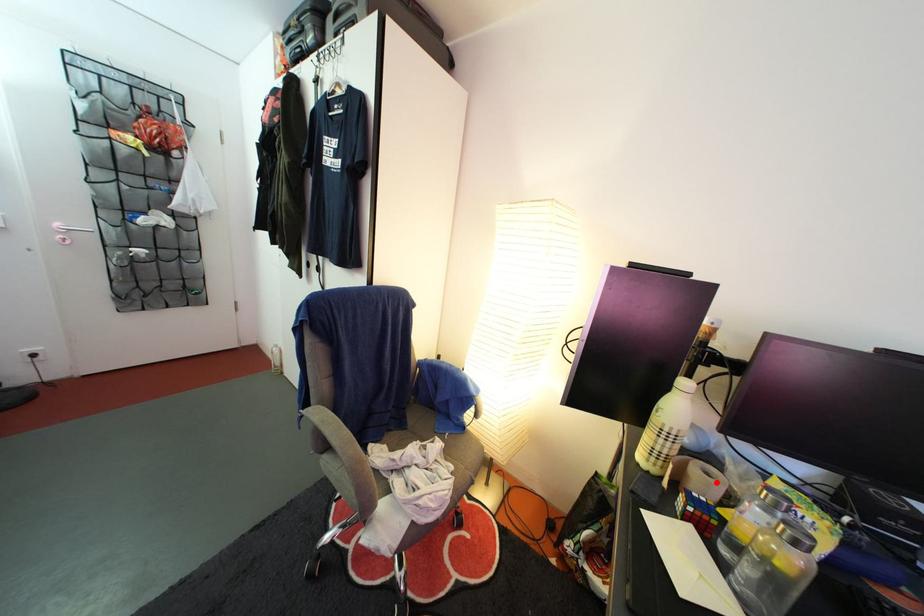
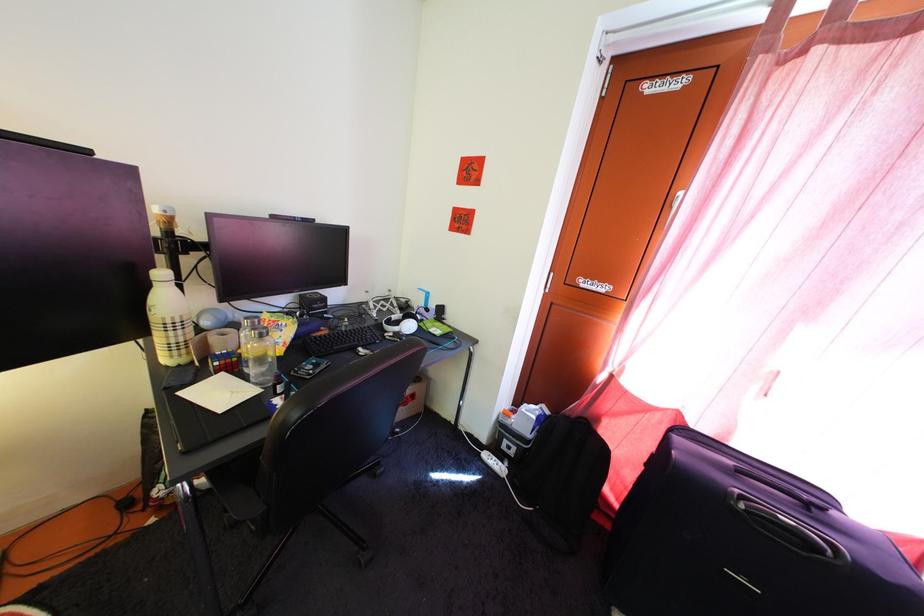
Locate, in the second image, the point that corresponds to the highlighted location in the first image.

(233, 342)